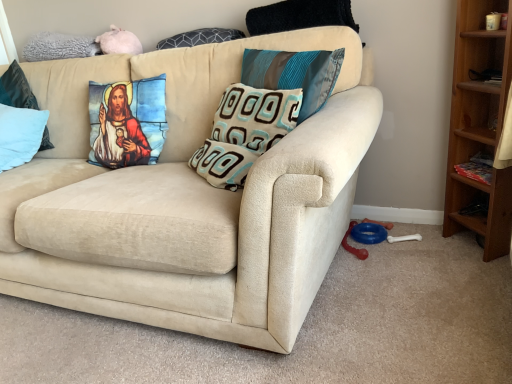
Question: Is beige textured pillow at center, which is the 2th pillow in right-to-left order, at the right side of teal silk pillow at upper center, the first pillow when ordered from right to left?

Choices:
 (A) yes
 (B) no

Answer: (B)

Question: Can you confirm if beige textured pillow at center, which is the fourth pillow from left to right, is taller than teal silk pillow at upper center, the fifth pillow in the left-to-right sequence?

Choices:
 (A) no
 (B) yes

Answer: (A)

Question: From the image's perspective, would you say beige textured pillow at center, which is the fourth pillow from left to right, is shown under teal silk pillow at upper center, the first pillow when ordered from right to left?

Choices:
 (A) no
 (B) yes

Answer: (B)

Question: Does beige textured pillow at center, which is the 2th pillow in right-to-left order, have a larger size compared to teal silk pillow at upper center, the fifth pillow in the left-to-right sequence?

Choices:
 (A) yes
 (B) no

Answer: (A)

Question: Is teal silk pillow at upper center, the fifth pillow in the left-to-right sequence, a part of beige textured pillow at center, which is the 2th pillow in right-to-left order?

Choices:
 (A) no
 (B) yes

Answer: (A)

Question: Looking at their shapes, would you say beige textured pillow at center, which is the fourth pillow from left to right, is wider or thinner than beige suede couch at center?

Choices:
 (A) wide
 (B) thin

Answer: (B)

Question: From their relative heights in the image, would you say beige textured pillow at center, which is the 2th pillow in right-to-left order, is taller or shorter than beige suede couch at center?

Choices:
 (A) tall
 (B) short

Answer: (B)

Question: Considering the positions of point (217, 115) and point (185, 107), is point (217, 115) closer or farther from the camera than point (185, 107)?

Choices:
 (A) closer
 (B) farther

Answer: (A)

Question: From the image's perspective, relative to beige suede couch at center, is beige textured pillow at center, which is the 2th pillow in right-to-left order, above or below?

Choices:
 (A) above
 (B) below

Answer: (A)

Question: Is light blue fabric pillow at left, which appears as the 4th pillow when viewed from the right, bigger or smaller than light blue fabric pillow at left, the first pillow in the left-to-right sequence?

Choices:
 (A) big
 (B) small

Answer: (B)

Question: In the image, is light blue fabric pillow at left, which appears as the 4th pillow when viewed from the right, positioned in front of or behind light blue fabric pillow at left, the first pillow in the left-to-right sequence?

Choices:
 (A) behind
 (B) front

Answer: (A)

Question: Is light blue fabric pillow at left, which appears as the 2th pillow when viewed from the left, wider or thinner than light blue fabric pillow at left, the 5th pillow viewed from the right?

Choices:
 (A) wide
 (B) thin

Answer: (B)

Question: From a real-world perspective, is light blue fabric pillow at left, which appears as the 2th pillow when viewed from the left, above or below light blue fabric pillow at left, the 5th pillow viewed from the right?

Choices:
 (A) below
 (B) above

Answer: (B)

Question: In terms of width, does teal silk pillow at upper center, the first pillow when ordered from right to left, look wider or thinner when compared to beige textured pillow at center, which is the 2th pillow in right-to-left order?

Choices:
 (A) thin
 (B) wide

Answer: (A)

Question: Visually, is teal silk pillow at upper center, the fifth pillow in the left-to-right sequence, positioned to the left or to the right of beige textured pillow at center, which is the 2th pillow in right-to-left order?

Choices:
 (A) right
 (B) left

Answer: (A)